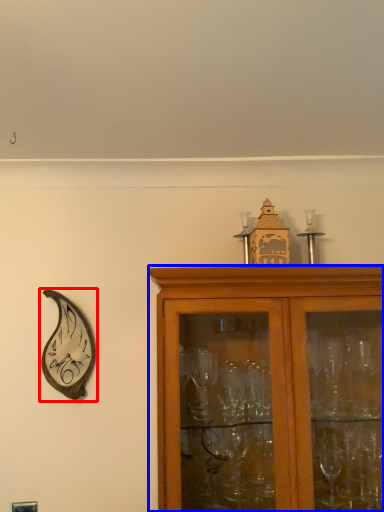
Question: Which of the following is the farthest to the observer, clock (highlighted by a red box) or cabinetry (highlighted by a blue box)?

Choices:
 (A) clock
 (B) cabinetry

Answer: (A)